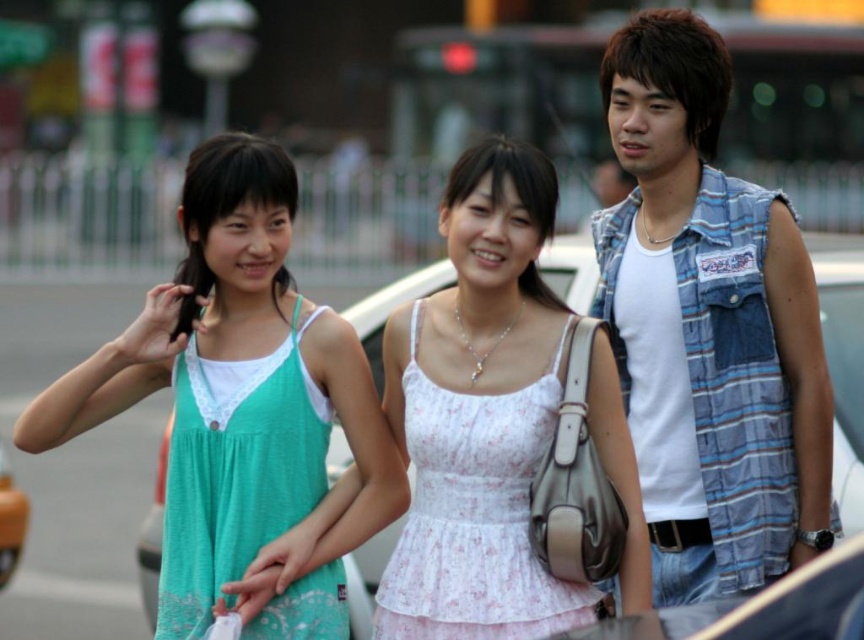
Question: Which object is the closest to the white fabric car at center?

Choices:
 (A) teal fabric dress at left
 (B) white floral dress at center

Answer: (B)

Question: Can you confirm if teal fabric dress at left is positioned above white floral dress at center?

Choices:
 (A) no
 (B) yes

Answer: (B)

Question: Is teal fabric dress at left further to camera compared to white fabric car at center?

Choices:
 (A) no
 (B) yes

Answer: (A)

Question: Is white floral dress at center to the right of white fabric car at center from the viewer's perspective?

Choices:
 (A) yes
 (B) no

Answer: (A)

Question: Among these points, which one is nearest to the camera?

Choices:
 (A) (143, 372)
 (B) (702, 410)
 (C) (858, 449)
 (D) (507, 321)

Answer: (B)

Question: Estimate the real-world distances between objects in this image. Which object is closer to the white floral dress at center?

Choices:
 (A) blue plaid vest at right
 (B) teal fabric dress at left
 (C) white fabric car at center

Answer: (B)